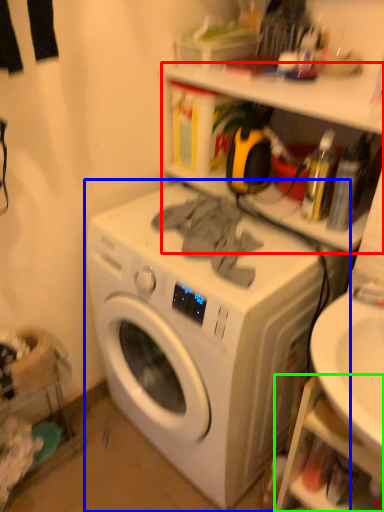
Question: Estimate the real-world distances between objects in this image. Which object is closer to shelf (highlighted by a red box), washing machine (highlighted by a blue box) or shelf (highlighted by a green box)?

Choices:
 (A) washing machine
 (B) shelf

Answer: (A)